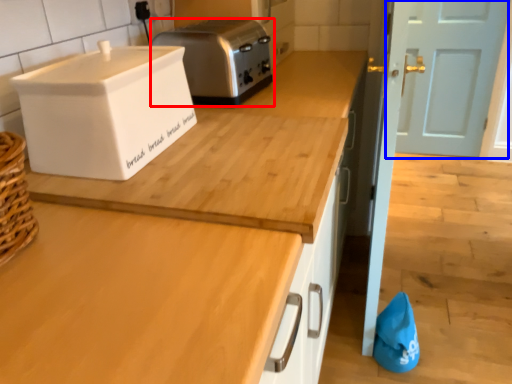
Question: Which object appears closest to the camera in this image, toaster (highlighted by a red box) or door (highlighted by a blue box)?

Choices:
 (A) toaster
 (B) door

Answer: (A)